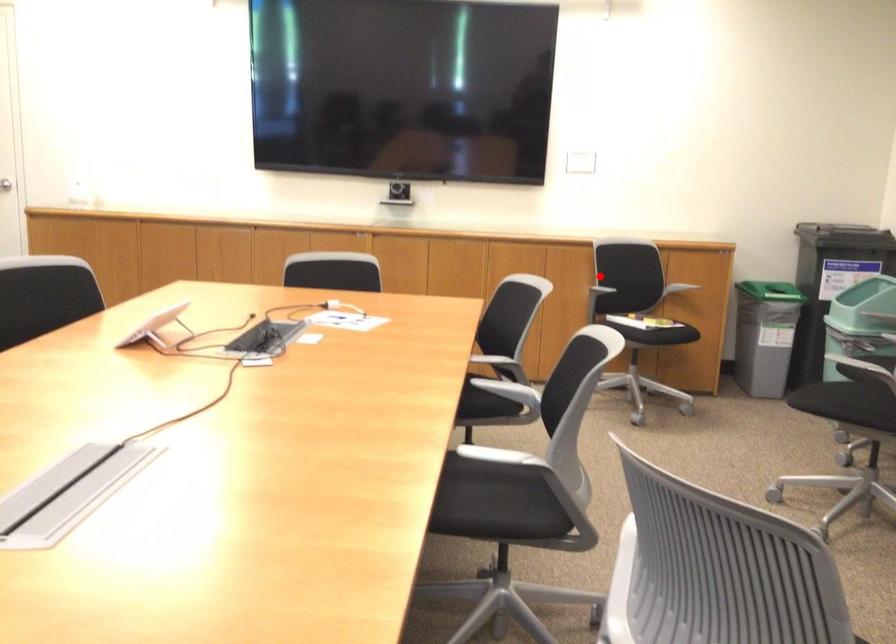
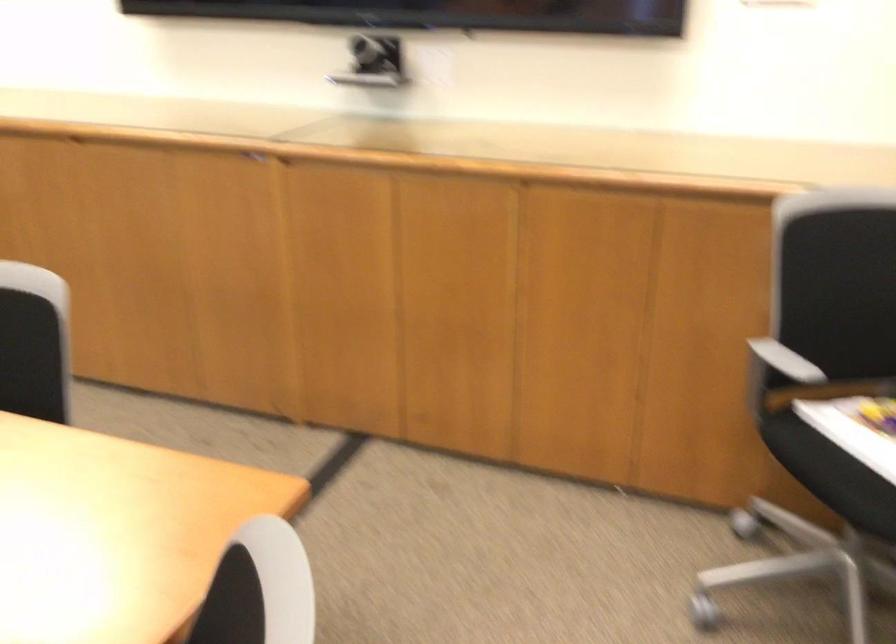
Question: A red point is marked in image1. In image2, is the corresponding 3D point closer to the camera or farther? Reply with the corresponding letter.

Choices:
 (A) The corresponding 3D point is closer.
 (B) The corresponding 3D point is farther.

Answer: (A)